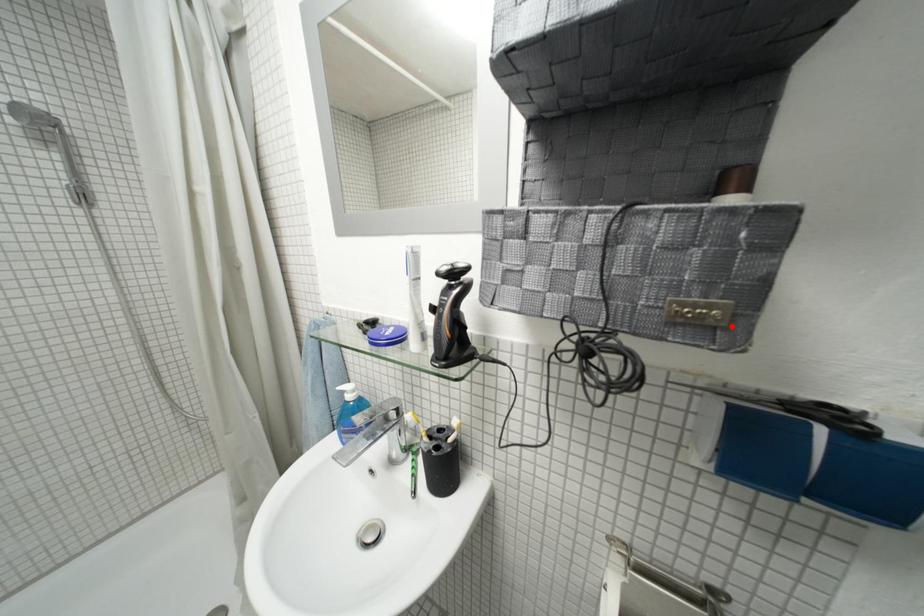
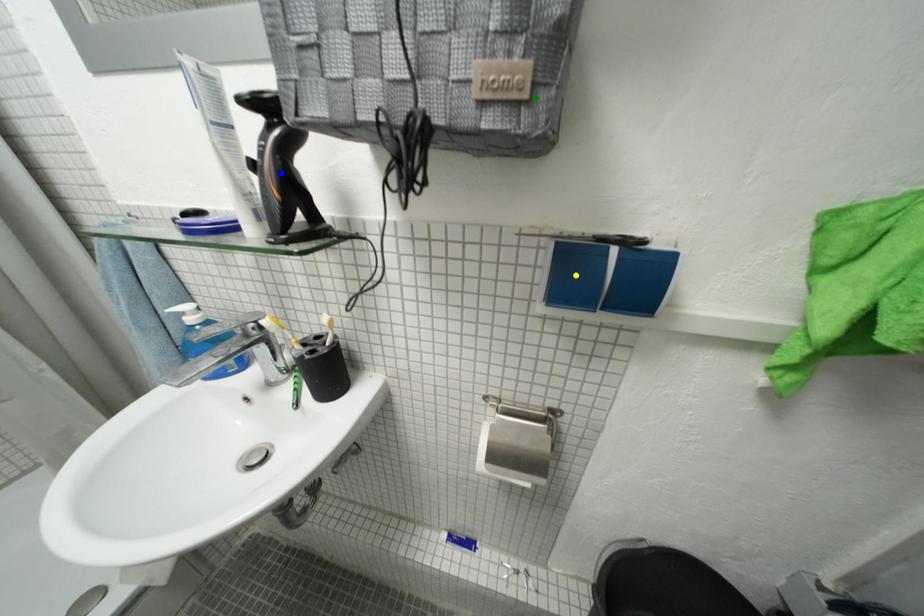
Question: I am providing you with two images of the same scene from different viewpoints. A red point is marked on the first image. You are given multiple points on the second image. Which point in image 2 represents the same 3d spot as the red point in image 1?

Choices:
 (A) yellow point
 (B) green point
 (C) blue point

Answer: (B)